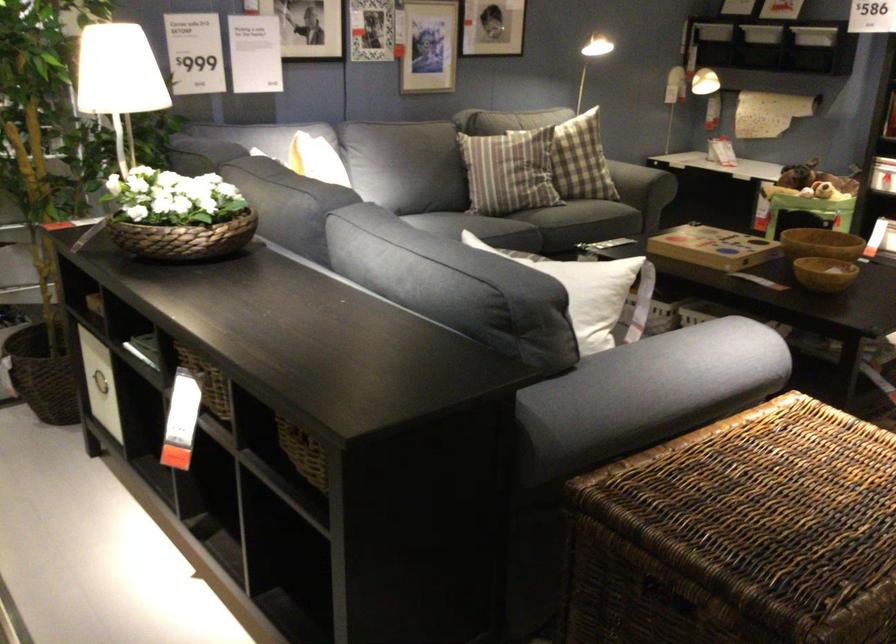
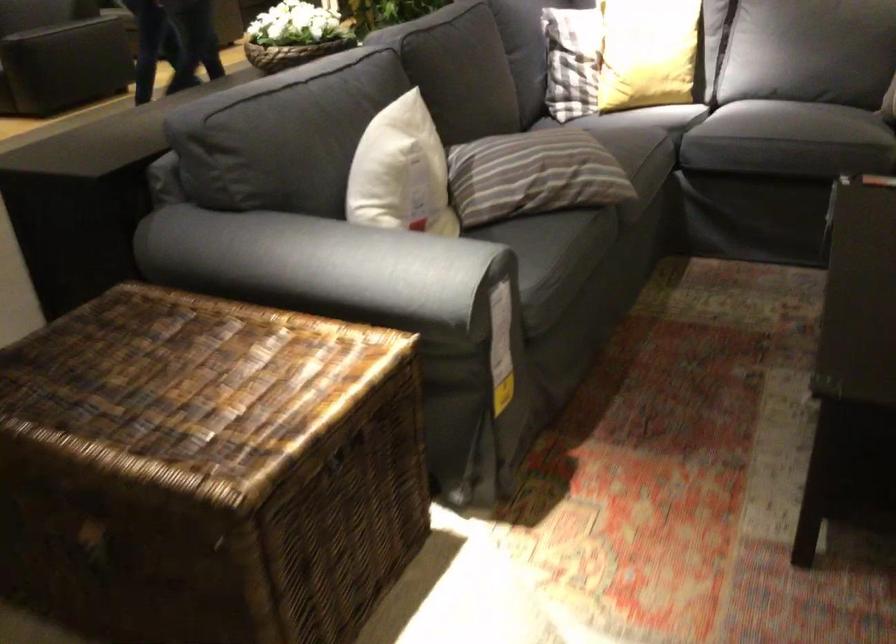
Question: I am providing you with two images of the same scene from different viewpoints. After the viewpoint changes to image2, which objects are now occluded?

Choices:
 (A) metal step stool
 (B) yellow pillow
 (C) grey sofa sitting surface
 (D) white box handle

Answer: (D)